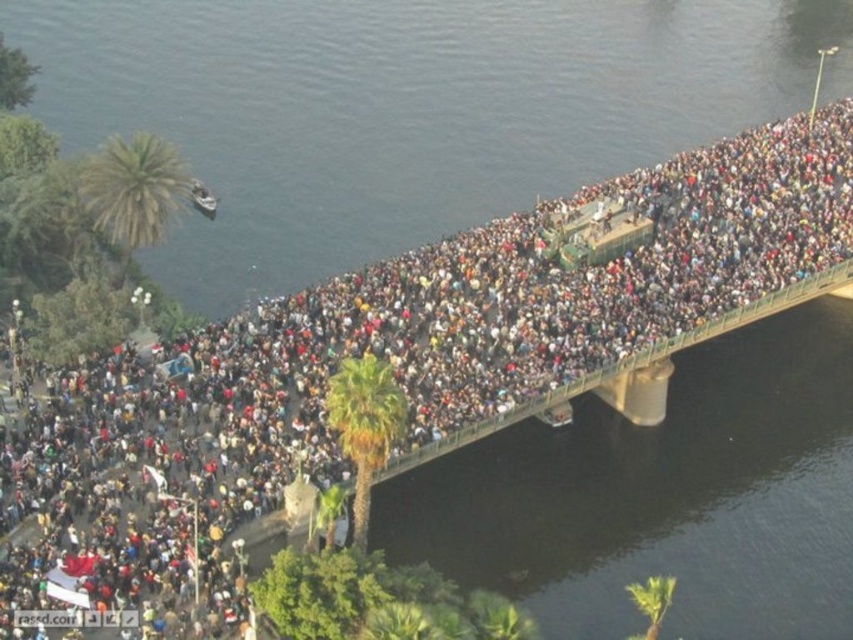
You are standing on the bridge and want to take a photo of the point at coordinates (314, 168). If your camera has a maximum focus range of 100 meters, will it be able to focus on that point?

The distance of point (314, 168) from the camera is 108.78 meters, which exceeds the camera maximum focus range of 100 meters. Therefore, the camera will not be able to focus on that point.

You are a photographer on the bridge and want to capture both the dark blue water at center and the metallic silver boat at upper left in a single shot. Based on their positions, which object should you frame first to ensure both are included?

The metallic silver boat at upper left should be framed first since the dark blue water at center is positioned to its right, meaning the boat is closer to the left edge of the frame. By centering the boat and panning slightly right, both objects can be captured together.